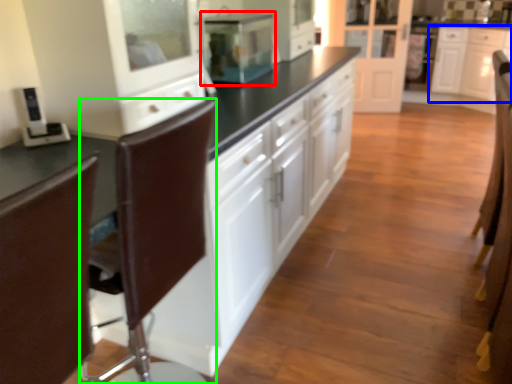
Question: Which object is positioned farthest from home appliance (highlighted by a red box)? Select from cabinetry (highlighted by a blue box) and swivel chair (highlighted by a green box).

Choices:
 (A) cabinetry
 (B) swivel chair

Answer: (A)